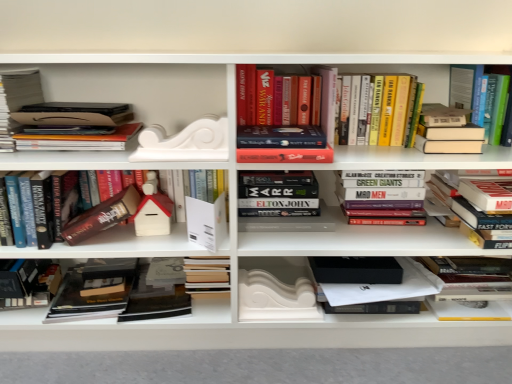
Question: Is hardcover book at lower left, which appears as the first paperback book when viewed from the left, in contact with hardcover book at center, marked as the 5th book in a left-to-right arrangement?

Choices:
 (A) no
 (B) yes

Answer: (A)

Question: Is hardcover book at lower left, the 5th paperback book in the right-to-left sequence, at the left side of hardcover book at center, marked as the 5th book in a left-to-right arrangement?

Choices:
 (A) yes
 (B) no

Answer: (A)

Question: From a real-world perspective, is hardcover book at lower left, the 5th paperback book in the right-to-left sequence, located higher than hardcover book at center, marked as the 5th book in a left-to-right arrangement?

Choices:
 (A) yes
 (B) no

Answer: (B)

Question: Considering the relative sizes of hardcover book at lower left, the 5th paperback book in the right-to-left sequence, and hardcover book at center, marked as the 5th book in a left-to-right arrangement, in the image provided, is hardcover book at lower left, the 5th paperback book in the right-to-left sequence, bigger than hardcover book at center, marked as the 5th book in a left-to-right arrangement,?

Choices:
 (A) no
 (B) yes

Answer: (A)

Question: From a real-world perspective, is hardcover book at lower left, which appears as the first paperback book when viewed from the left, below hardcover book at center, which appears as the sixth book when viewed from the right?

Choices:
 (A) yes
 (B) no

Answer: (A)

Question: In the image, is white matte book at center, the second paperback book when ordered from right to left, positioned in front of or behind matte cardboard box at left, acting as the 3th book starting from the left?

Choices:
 (A) front
 (B) behind

Answer: (B)

Question: Is white matte book at center, the 4th paperback book when ordered from left to right, bigger or smaller than matte cardboard box at left, marked as the eighth book in a right-to-left arrangement?

Choices:
 (A) big
 (B) small

Answer: (B)

Question: Considering the positions of white matte book at center, the second paperback book when ordered from right to left, and matte cardboard box at left, acting as the 3th book starting from the left, in the image, is white matte book at center, the second paperback book when ordered from right to left, wider or thinner than matte cardboard box at left, acting as the 3th book starting from the left,?

Choices:
 (A) thin
 (B) wide

Answer: (A)

Question: Visually, is white matte book at center, the second paperback book when ordered from right to left, positioned to the left or to the right of matte cardboard box at left, acting as the 3th book starting from the left?

Choices:
 (A) right
 (B) left

Answer: (A)

Question: Would you say white matte house at center, which is the fourth book from left to right, is inside or outside hardcover book at lower left, the 5th paperback book in the right-to-left sequence?

Choices:
 (A) outside
 (B) inside

Answer: (A)

Question: From the image's perspective, is white matte house at center, which is the fourth book from left to right, above or below hardcover book at lower left, the 5th paperback book in the right-to-left sequence?

Choices:
 (A) above
 (B) below

Answer: (A)

Question: In terms of width, does white matte house at center, which is the fourth book from left to right, look wider or thinner when compared to hardcover book at lower left, the 5th paperback book in the right-to-left sequence?

Choices:
 (A) wide
 (B) thin

Answer: (B)

Question: Does point (224, 172) appear closer or farther from the camera than point (57, 292)?

Choices:
 (A) closer
 (B) farther

Answer: (A)

Question: From a real-world perspective, is hardcover book at upper right, the 1th book viewed from the right, physically located above or below hardcover book at center, which appears as the 3th paperback book when viewed from the left?

Choices:
 (A) below
 (B) above

Answer: (B)

Question: From their relative heights in the image, would you say hardcover book at upper right, the 1th book viewed from the right, is taller or shorter than hardcover book at center, which appears as the 3th paperback book when viewed from the left?

Choices:
 (A) short
 (B) tall

Answer: (B)